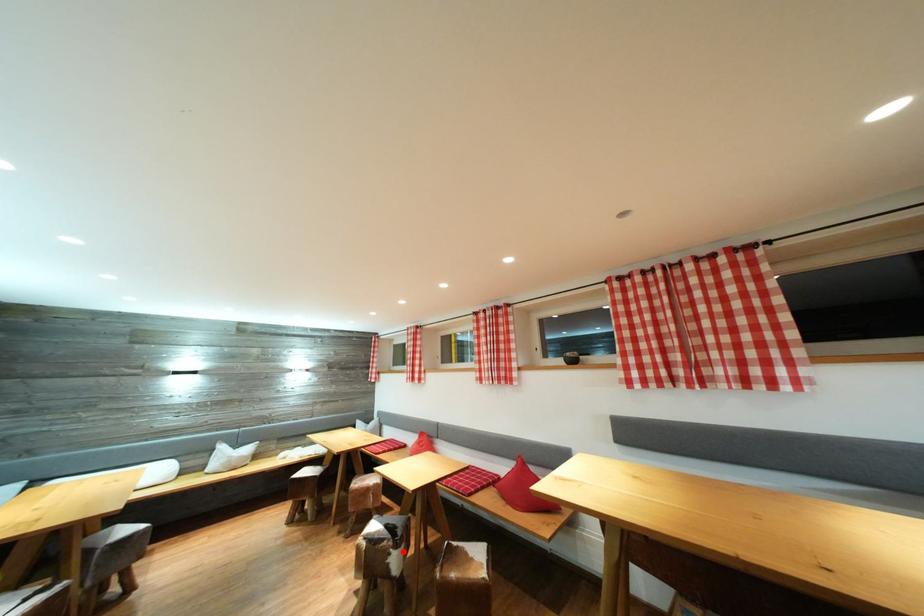
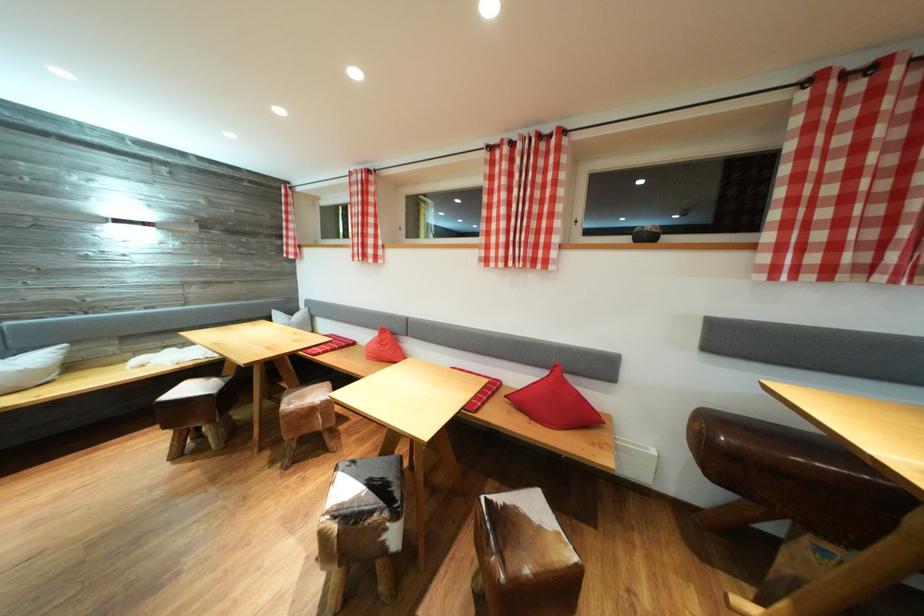
Question: I am providing you with two images of the same scene from different viewpoints. A red point is shown in image1. For the corresponding object point in image2, is it positioned nearer or farther from the camera?

Choices:
 (A) Nearer
 (B) Farther

Answer: (B)